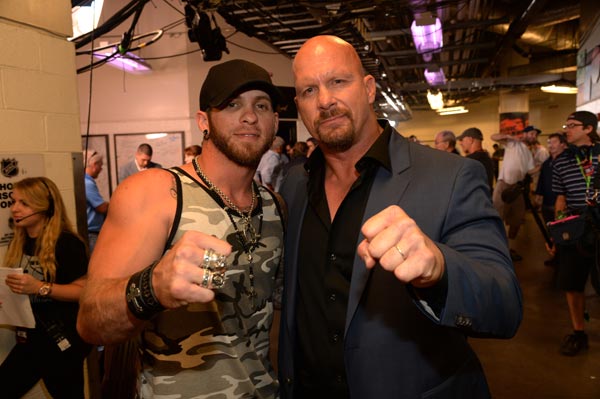
Identify the location of boom arm. (536, 218).